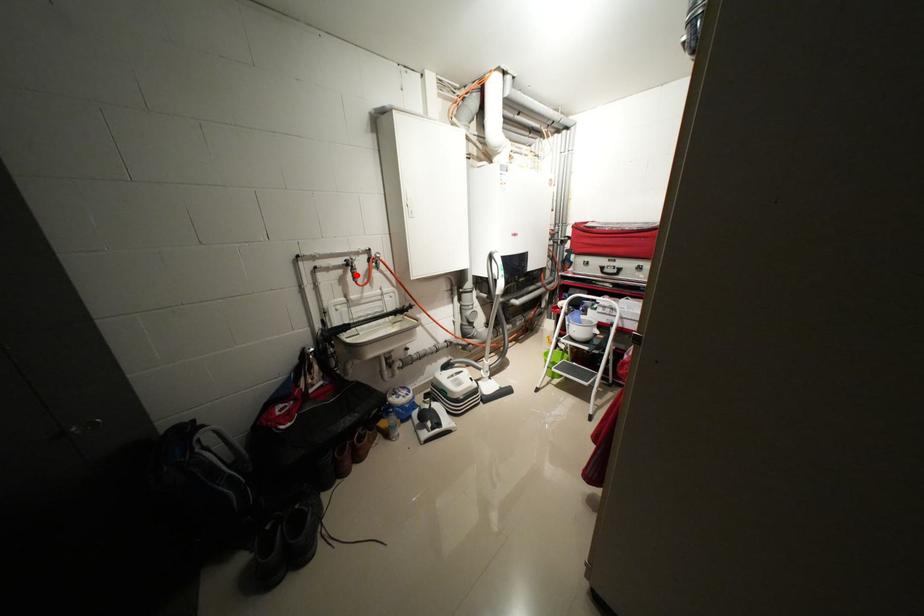
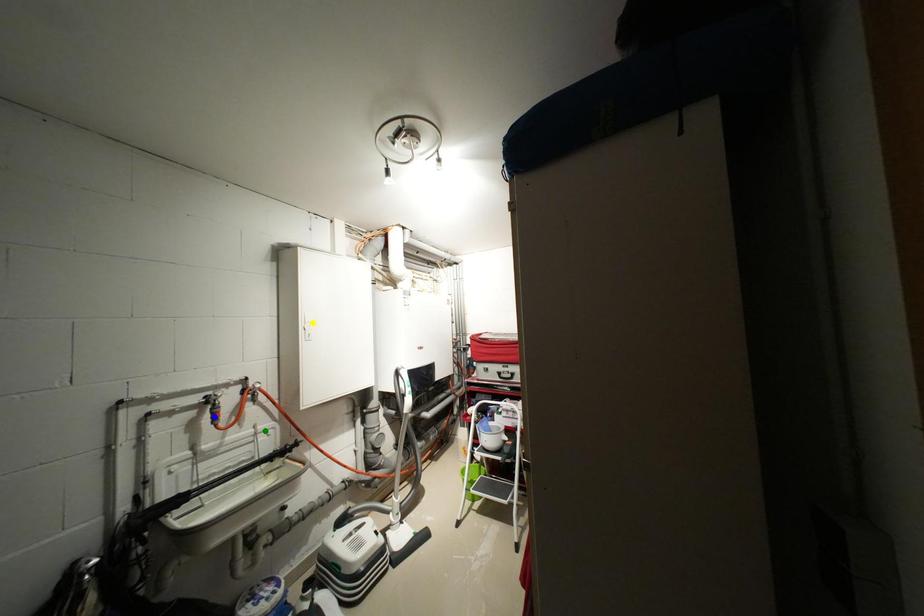
Question: I am providing you with two images of the same scene from different viewpoints. A red point is marked on the first image. You are given multiple points on the second image. Which spot in image 2 lines up with the point in image 1?

Choices:
 (A) green point
 (B) blue point
 (C) yellow point

Answer: (B)